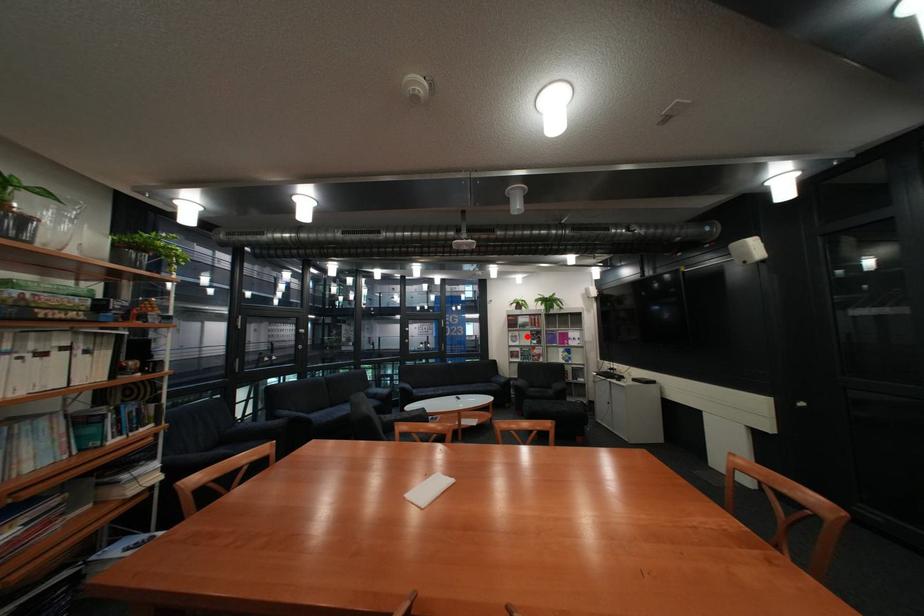
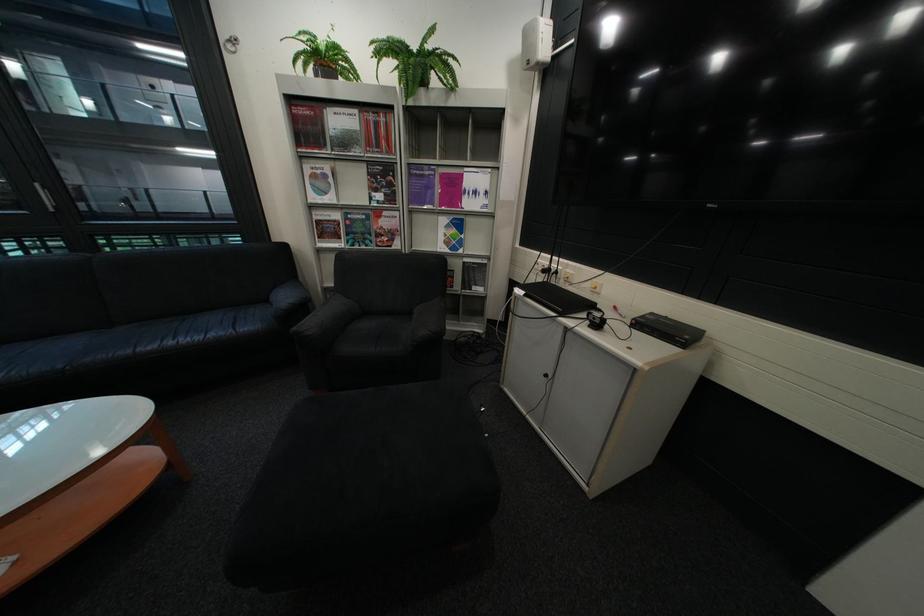
Where in the second image is the point corresponding to the highlighted location from the first image?

(329, 177)